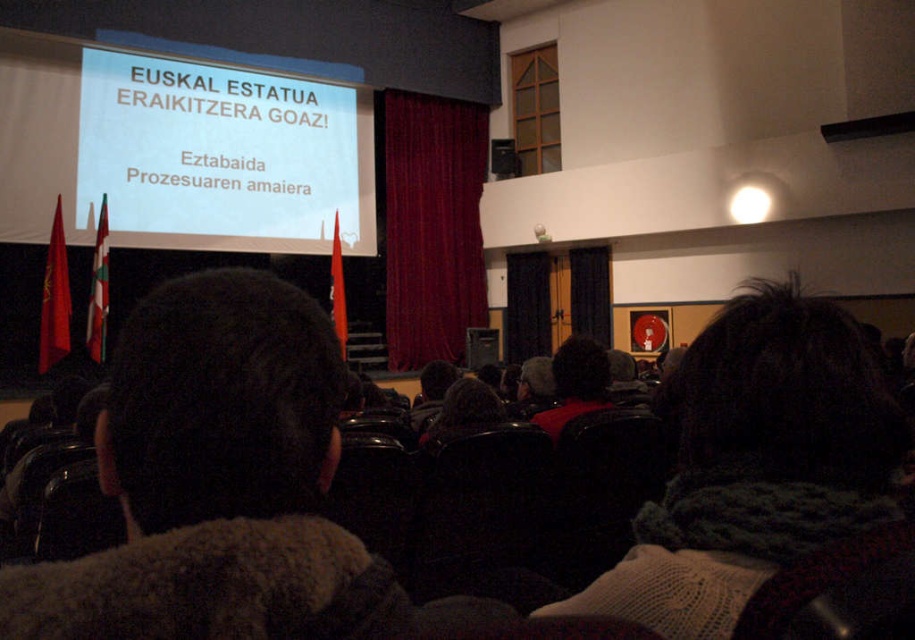
Looking at this image, you are an attendee sitting in the front row of the conference hall. You notice two points marked in the room. The first point is at coordinate (192, 136) and the second point is at coordinate (558, 353). Which point is closer to you?

Point (192, 136) is closer to you because it is further to the camera than point (558, 353).

You are an event organizer who needs to place a 1.2 meter wide banner between the dark brown fur coat at center and the black fabric curtain at center. Can the space between them accommodate the banner?

The dark brown fur coat at center is narrower than the black fabric curtain at center. However, the exact distance between them isn not specified in the provided information. Therefore, it is uncertain whether the 1.2 meter wide banner can fit in the space between them.

You are an attendee at the presentation. You notice the white glossy projector screen at upper center and the dark brown hair at center. Which object is positioned to the left?

The white glossy projector screen at upper center is to the left of dark brown hair at center.